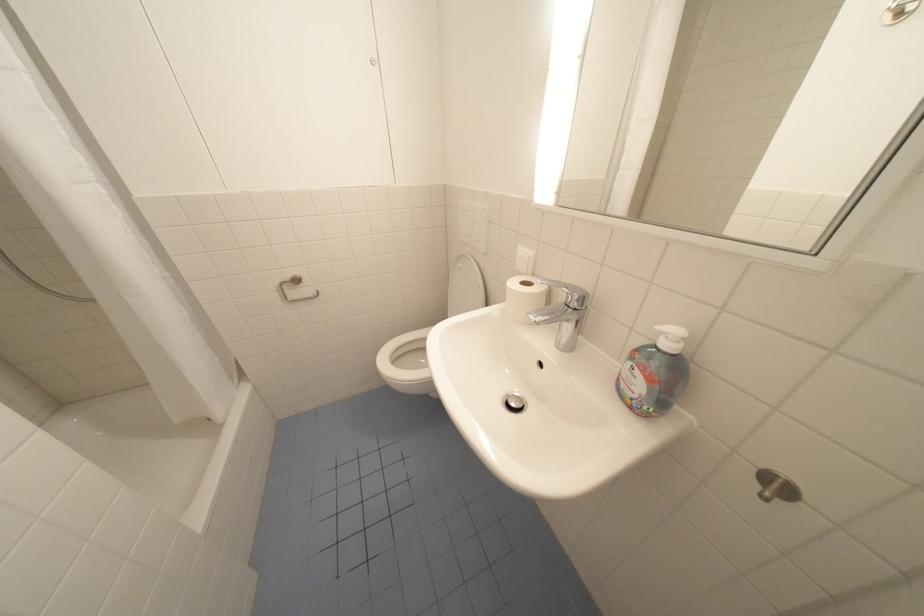
Where is `chrome faucet handle`? This screenshot has height=616, width=924. chrome faucet handle is located at coordinates (569, 293).